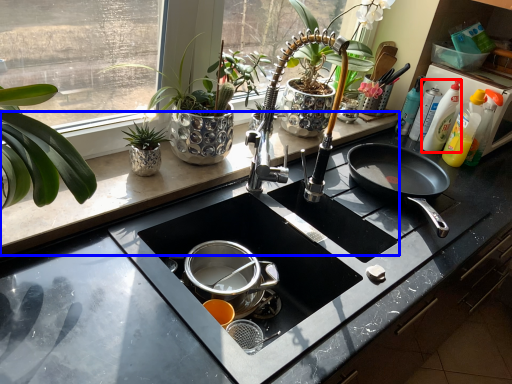
Question: Which point is closer to the camera, cleaning product (highlighted by a red box) or counter top (highlighted by a blue box)?

Choices:
 (A) cleaning product
 (B) counter top

Answer: (B)